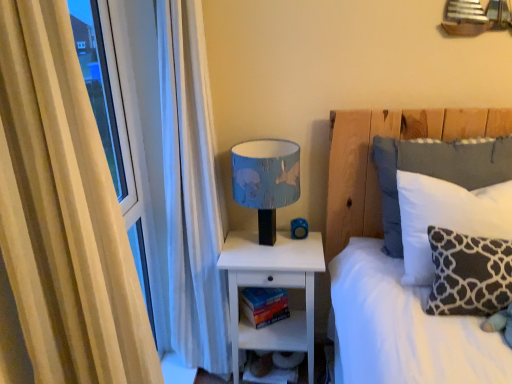
Question: Is point (386, 241) positioned closer to the camera than point (509, 301)?

Choices:
 (A) farther
 (B) closer

Answer: (A)

Question: From a real-world perspective, relative to dark gray velvety pillow at right, which is counted as the first pillow, starting from the front, is white soft pillow at upper right, which is the first pillow in back-to-front order, vertically above or below?

Choices:
 (A) above
 (B) below

Answer: (A)

Question: Considering the real-world distances, which object is farthest from the dark gray velvety pillow at right, which is counted as the first pillow, starting from the front?

Choices:
 (A) white matte nightstand at center
 (B) white soft pillow at upper right, which is the first pillow in back-to-front order
 (C) hardcover book at lower center
 (D) blue fabric lampshade at upper right
 (E) beige fabric curtain at left

Answer: (E)

Question: Which object is positioned farthest from the beige fabric curtain at left?

Choices:
 (A) dark gray fabric pillow at right, the 2th pillow positioned from the front
 (B) dark gray velvety pillow at right, which is counted as the first pillow, starting from the front
 (C) hardcover book at lower center
 (D) white soft pillow at upper right, which is the first pillow in back-to-front order
 (E) white matte nightstand at center

Answer: (C)